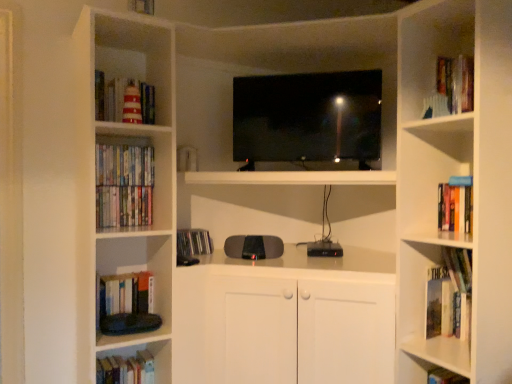
Question: Considering the relative sizes of hardcover book at left, which is the 5th book from top to bottom, and hardcover books at left, acting as the fifth book starting from the bottom, in the image provided, is hardcover book at left, which is the 5th book from top to bottom, bigger than hardcover books at left, acting as the fifth book starting from the bottom,?

Choices:
 (A) yes
 (B) no

Answer: (A)

Question: From a real-world perspective, is hardcover book at left, which ranks as the fourth book in right-to-left order, on hardcover books at left, acting as the fifth book starting from the bottom?

Choices:
 (A) yes
 (B) no

Answer: (B)

Question: Does hardcover book at left, which is the 3th book from bottom to top, come in front of hardcover books at left, acting as the fifth book starting from the bottom?

Choices:
 (A) no
 (B) yes

Answer: (B)

Question: Does hardcover book at left, which is the 5th book from top to bottom, contain hardcover books at left, the 7th book from the right?

Choices:
 (A) yes
 (B) no

Answer: (B)

Question: Can you confirm if hardcover book at left, placed as the fourth book when sorted from left to right, is positioned to the right of hardcover books at left, which is counted as the third book, starting from the top?

Choices:
 (A) no
 (B) yes

Answer: (B)

Question: From the image's perspective, is hardcover book at left, which is the 5th book from top to bottom, over hardcover books at left, which is the 1th book from left to right?

Choices:
 (A) no
 (B) yes

Answer: (A)

Question: Does hardcover book at left, placed as the fourth book when sorted from left to right, have a lesser height compared to black glossy screen at center?

Choices:
 (A) yes
 (B) no

Answer: (A)

Question: Is hardcover book at left, which is the 3th book from bottom to top, placed right next to black glossy screen at center?

Choices:
 (A) no
 (B) yes

Answer: (A)

Question: Considering the relative sizes of hardcover book at left, placed as the fourth book when sorted from left to right, and black glossy screen at center in the image provided, is hardcover book at left, placed as the fourth book when sorted from left to right, bigger than black glossy screen at center?

Choices:
 (A) no
 (B) yes

Answer: (A)

Question: Is hardcover book at left, which is the 3th book from bottom to top, positioned before black glossy screen at center?

Choices:
 (A) no
 (B) yes

Answer: (B)

Question: Considering the relative positions of hardcover book at left, placed as the fourth book when sorted from left to right, and black glossy screen at center in the image provided, is hardcover book at left, placed as the fourth book when sorted from left to right, to the right of black glossy screen at center from the viewer's perspective?

Choices:
 (A) no
 (B) yes

Answer: (A)

Question: From a real-world perspective, is hardcover book at left, which is the 5th book from top to bottom, on black glossy screen at center?

Choices:
 (A) yes
 (B) no

Answer: (B)

Question: Does black glossy screen at center have a lesser width compared to hardcover book at lower right, the 1th book ordered from the bottom?

Choices:
 (A) no
 (B) yes

Answer: (A)